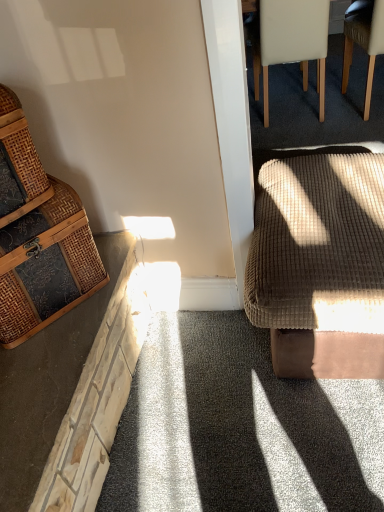
Question: Does velvet brown footstool at right have a greater width compared to woven brown basket at left?

Choices:
 (A) yes
 (B) no

Answer: (A)

Question: Would you say velvet brown footstool at right contains woven brown basket at left?

Choices:
 (A) yes
 (B) no

Answer: (B)

Question: Is velvet brown footstool at right outside woven brown basket at left?

Choices:
 (A) no
 (B) yes

Answer: (B)

Question: From a real-world perspective, is velvet brown footstool at right located beneath woven brown basket at left?

Choices:
 (A) yes
 (B) no

Answer: (A)

Question: Considering the relative sizes of velvet brown footstool at right and woven brown basket at left in the image provided, is velvet brown footstool at right smaller than woven brown basket at left?

Choices:
 (A) yes
 (B) no

Answer: (B)

Question: Can you confirm if velvet brown footstool at right is bigger than woven brown basket at left?

Choices:
 (A) no
 (B) yes

Answer: (B)

Question: From a real-world perspective, is woven rattan chest at left, acting as the third chair starting from the right, over white leather chair at upper right, the third chair ordered from the bottom?

Choices:
 (A) yes
 (B) no

Answer: (A)

Question: Can you confirm if woven rattan chest at left, which ranks as the 1th chair in bottom-to-top order, is bigger than white leather chair at upper right, which is the second chair in left-to-right order?

Choices:
 (A) no
 (B) yes

Answer: (A)

Question: Is white leather chair at upper right, which is counted as the first chair, starting from the back, a part of woven rattan chest at left, the first chair when ordered from front to back?

Choices:
 (A) yes
 (B) no

Answer: (B)

Question: Is woven rattan chest at left, the first chair when ordered from front to back, smaller than white leather chair at upper right, which is counted as the second chair, starting from the right?

Choices:
 (A) no
 (B) yes

Answer: (B)

Question: From a real-world perspective, is woven rattan chest at left, acting as the 3th chair starting from the back, under white leather chair at upper right, which is counted as the first chair, starting from the back?

Choices:
 (A) yes
 (B) no

Answer: (B)

Question: Considering the relative positions of woven rattan chest at left, which ranks as the 1th chair in left-to-right order, and white leather chair at upper right, which is the 1th chair in top-to-bottom order, in the image provided, is woven rattan chest at left, which ranks as the 1th chair in left-to-right order, in front of white leather chair at upper right, which is the 1th chair in top-to-bottom order,?

Choices:
 (A) yes
 (B) no

Answer: (A)

Question: Would you consider woven brown basket at left to be distant from woven rattan chest at left, the third chair positioned from the top?

Choices:
 (A) no
 (B) yes

Answer: (A)